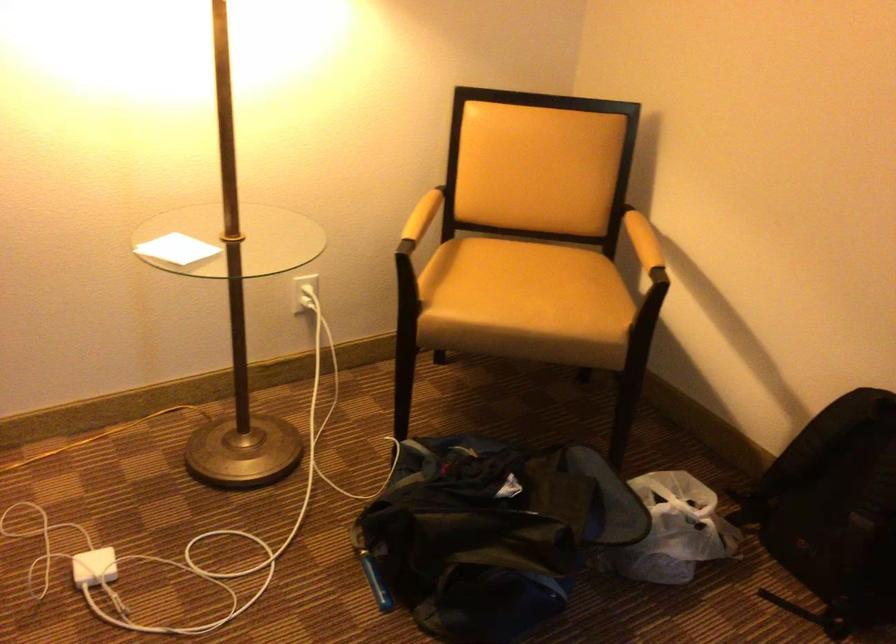
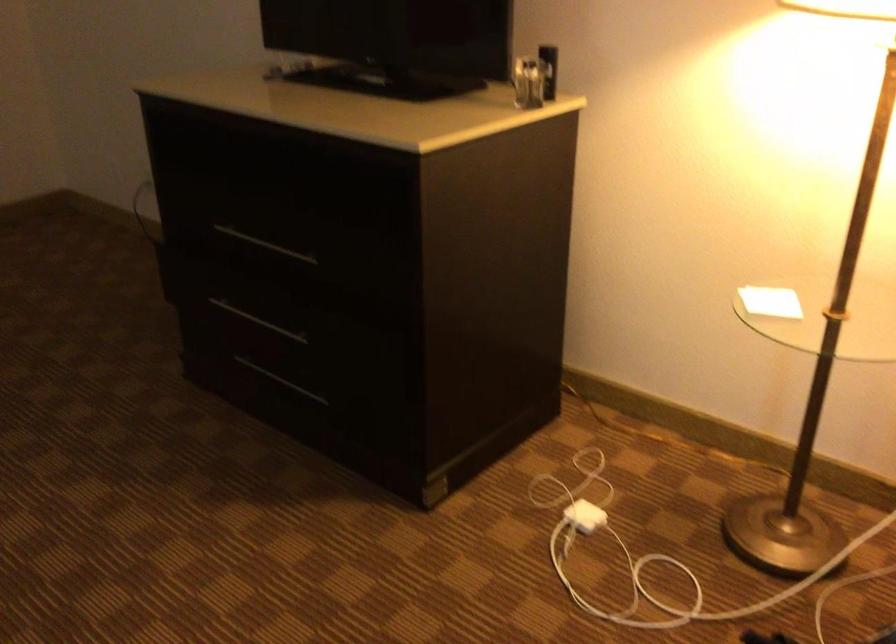
Question: The camera is either moving clockwise (left) or counter-clockwise (right) around the object. The first image is from the beginning of the video and the second image is from the end. Is the camera moving left or right when shooting the video?

Choices:
 (A) Left
 (B) Right

Answer: (B)